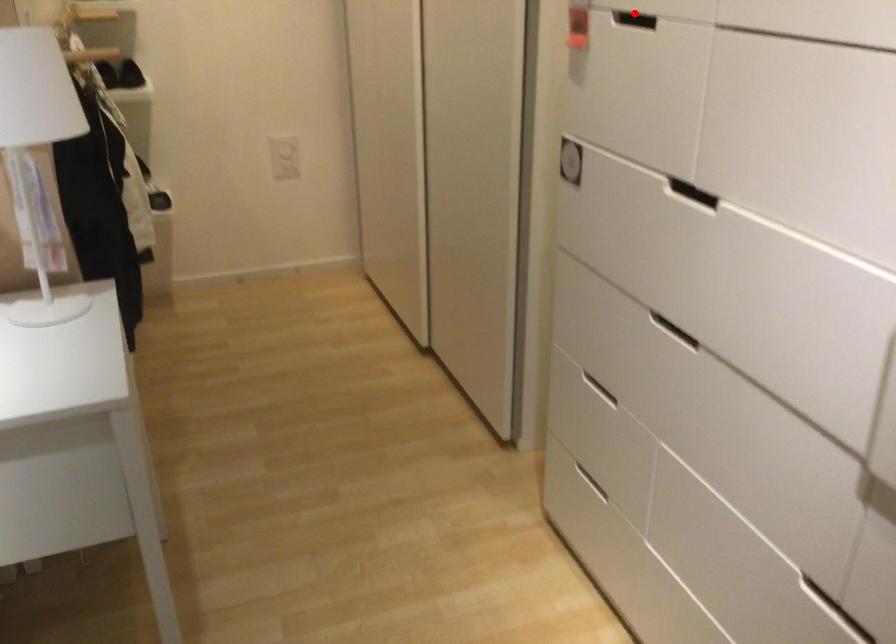
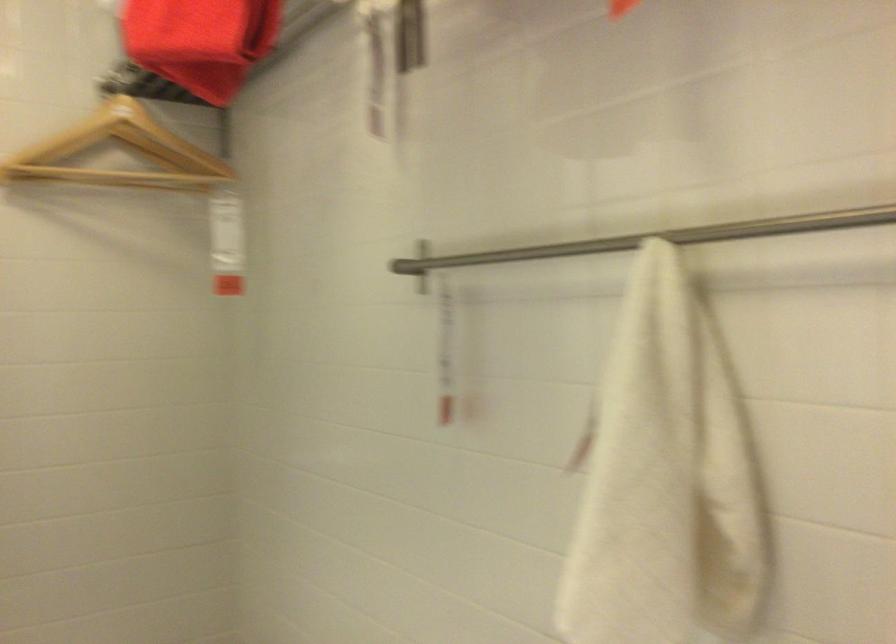
Question: I am providing you with two images of the same scene from different viewpoints. A red point is marked on the first image. Is the red point's position out of view in image 2?

Choices:
 (A) Yes
 (B) No

Answer: (A)